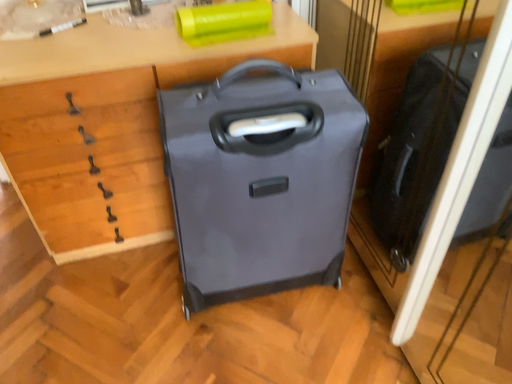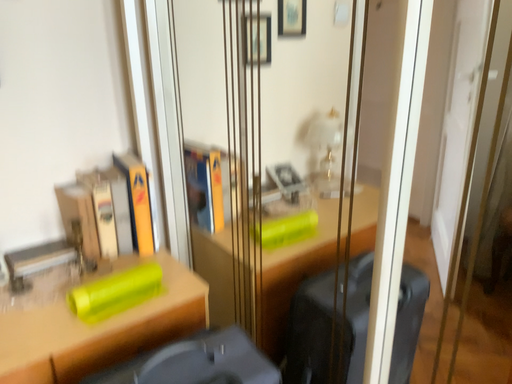
Question: How did the camera likely rotate when shooting the video?

Choices:
 (A) rotated downward
 (B) rotated upward

Answer: (B)